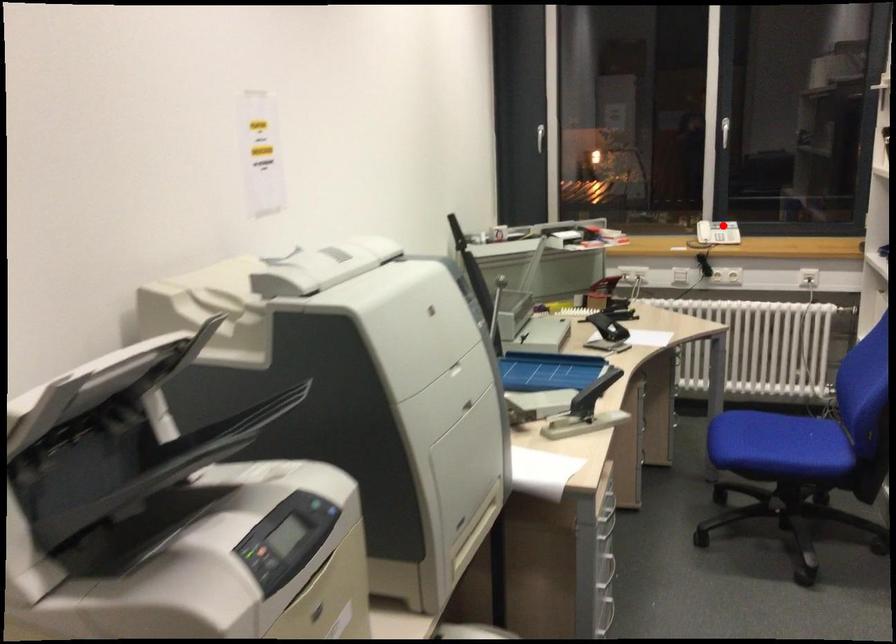
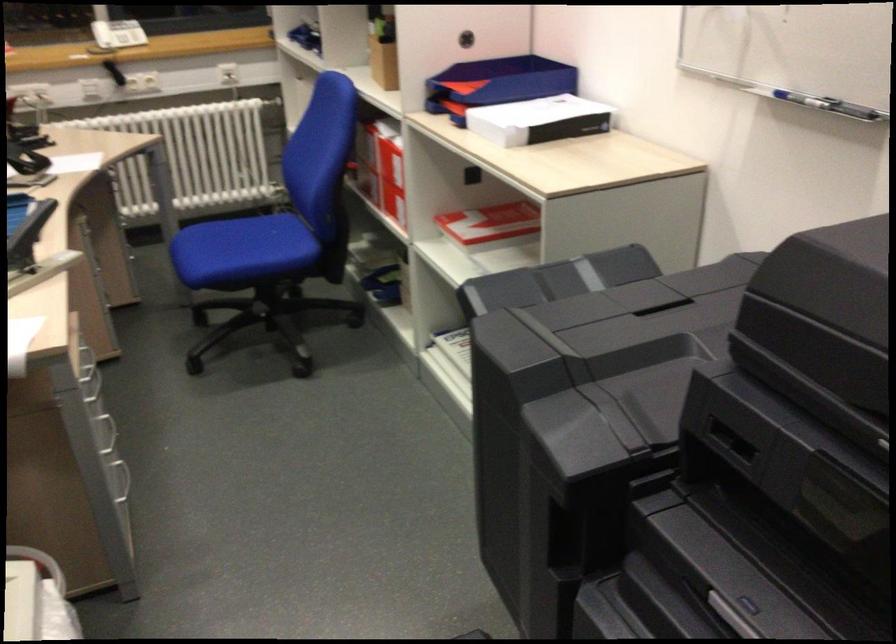
Question: A red point is marked in image1. In image2, is the corresponding 3D point closer to the camera or farther? Reply with the corresponding letter.

Choices:
 (A) The corresponding 3D point is closer.
 (B) The corresponding 3D point is farther.

Answer: (A)